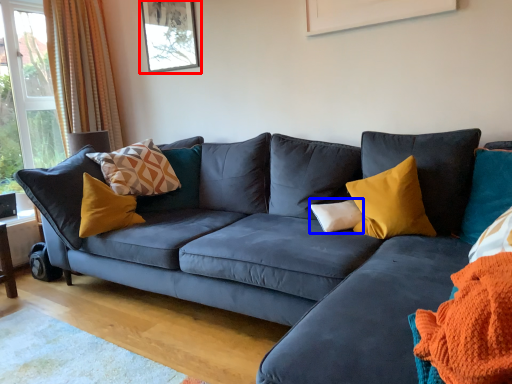
Question: Which object is closer to the camera taking this photo, picture frame (highlighted by a red box) or pillow (highlighted by a blue box)?

Choices:
 (A) picture frame
 (B) pillow

Answer: (B)